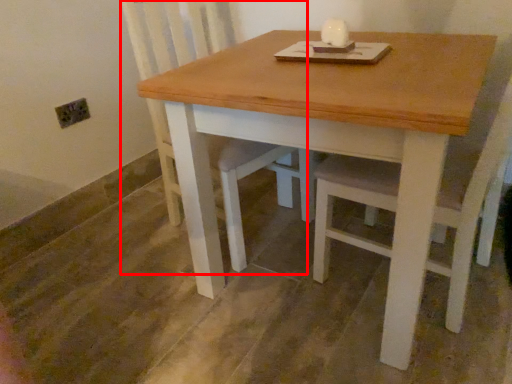
Question: In this image, where is swivel chair (annotated by the red box) located relative to table?

Choices:
 (A) left
 (B) right

Answer: (A)